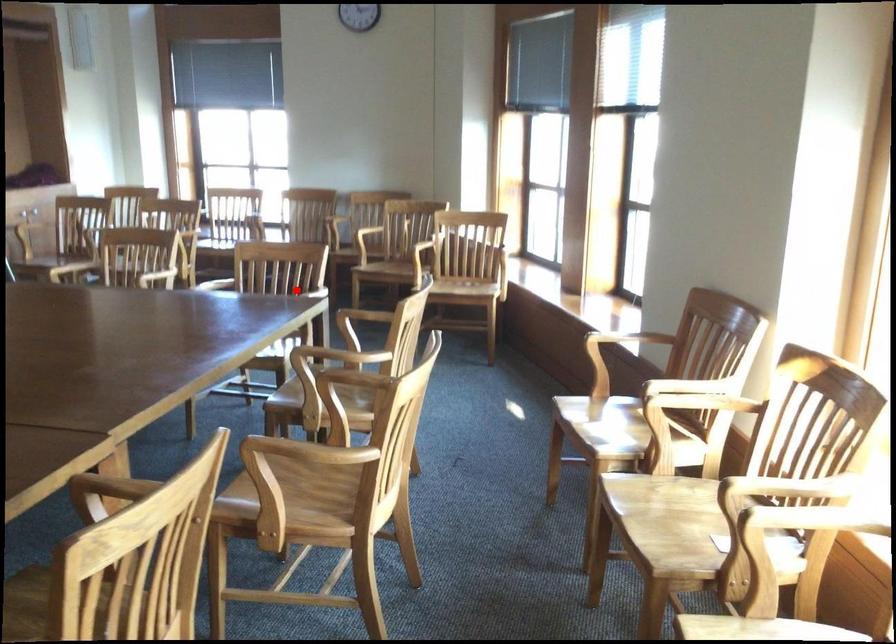
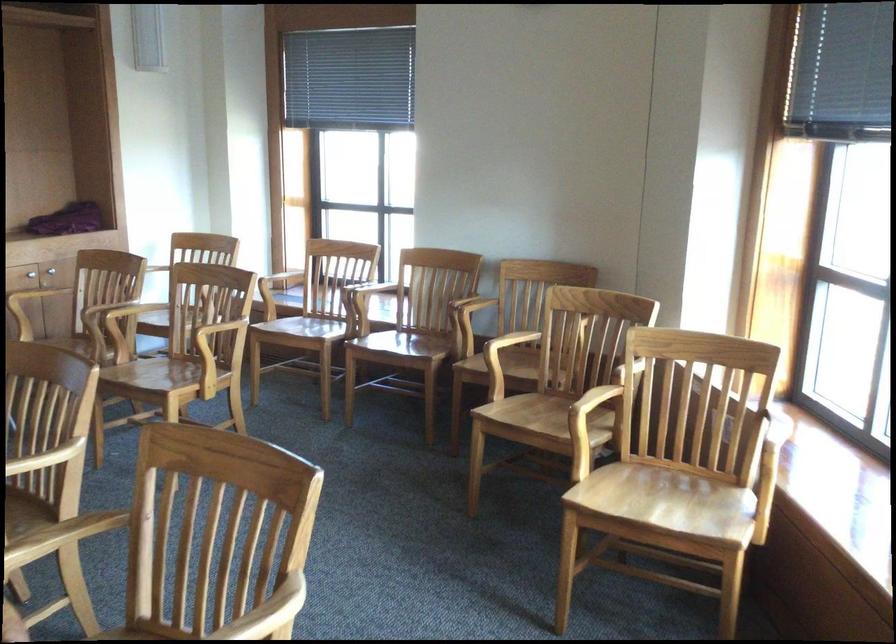
Question: I am providing you with two images of the same scene from different viewpoints. A red point is marked on the first image. Can you still see the location of the red point in image 2?

Choices:
 (A) Yes
 (B) No

Answer: (A)